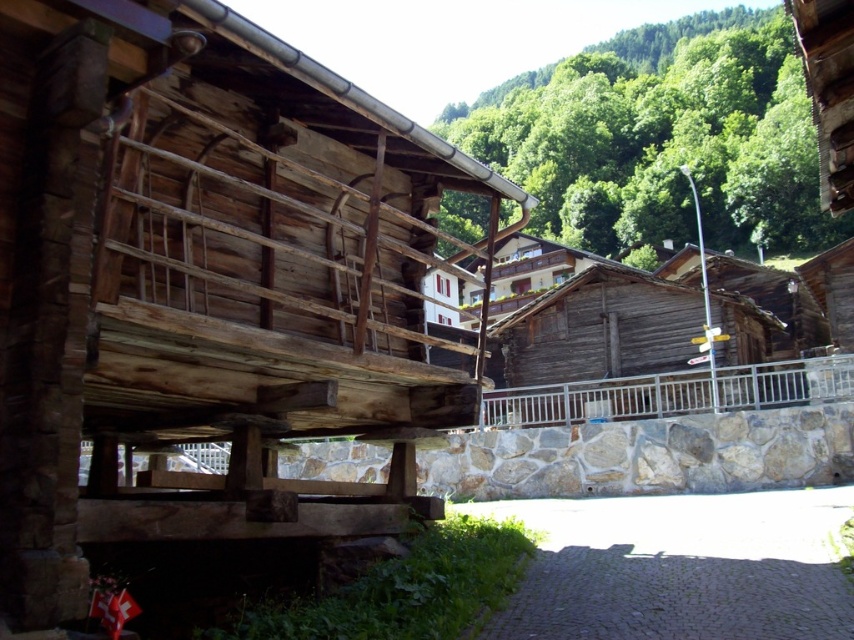
Question: Is natural wood hut at center bigger than silver metallic balustrade at center?

Choices:
 (A) no
 (B) yes

Answer: (B)

Question: Which point is farther from the camera taking this photo?

Choices:
 (A) (554, 410)
 (B) (108, 291)

Answer: (A)

Question: Estimate the real-world distances between objects in this image. Which object is closer to the natural wood hut at center?

Choices:
 (A) weathered wood hut at center
 (B) silver metallic balustrade at center

Answer: (B)

Question: Can you confirm if weathered wood hut at center is positioned to the right of silver metallic balustrade at center?

Choices:
 (A) yes
 (B) no

Answer: (A)

Question: Based on their relative distances, which object is farther from the natural wood hut at center?

Choices:
 (A) weathered wood hut at center
 (B) silver metallic balustrade at center

Answer: (A)

Question: Is weathered wood hut at center below silver metallic balustrade at center?

Choices:
 (A) yes
 (B) no

Answer: (B)